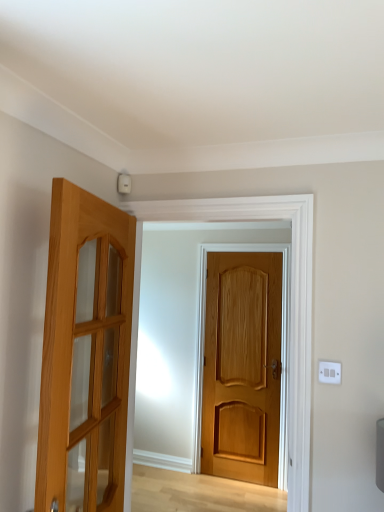
Where is `vacant area situated to the left side of light brown wooden door at center, acting as the 2th door starting from the left`? vacant area situated to the left side of light brown wooden door at center, acting as the 2th door starting from the left is located at coordinates (204, 485).